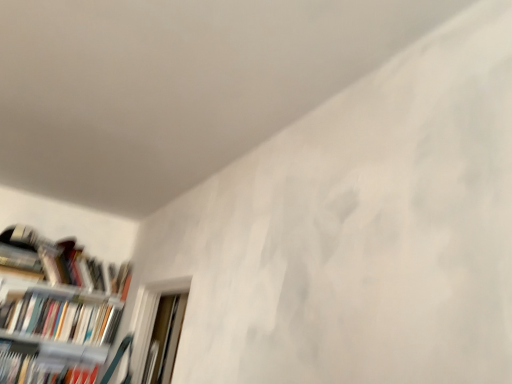
Question: Considering the relative positions of white plastic bookcase at lower left and hardcover book at left, marked as the first book in a top-to-bottom arrangement, in the image provided, is white plastic bookcase at lower left to the left of hardcover book at left, marked as the first book in a top-to-bottom arrangement, from the viewer's perspective?

Choices:
 (A) no
 (B) yes

Answer: (B)

Question: Does white plastic bookcase at lower left have a greater height compared to hardcover book at left, the third book from the bottom?

Choices:
 (A) no
 (B) yes

Answer: (B)

Question: From the image's perspective, is white plastic bookcase at lower left located beneath hardcover book at left, marked as the first book in a top-to-bottom arrangement?

Choices:
 (A) no
 (B) yes

Answer: (B)

Question: From a real-world perspective, does white plastic bookcase at lower left stand above hardcover book at left, the third book from the bottom?

Choices:
 (A) yes
 (B) no

Answer: (B)

Question: Is the depth of white plastic bookcase at lower left less than that of hardcover book at left, the third book from the bottom?

Choices:
 (A) no
 (B) yes

Answer: (B)

Question: Is white plastic bookcase at lower left next to hardcover book at left, marked as the first book in a top-to-bottom arrangement?

Choices:
 (A) no
 (B) yes

Answer: (A)

Question: Considering the relative positions of white plastic bookcase at lower left and hardcover book at lower left, positioned as the third book in top-to-bottom order, in the image provided, is white plastic bookcase at lower left to the right of hardcover book at lower left, positioned as the third book in top-to-bottom order, from the viewer's perspective?

Choices:
 (A) yes
 (B) no

Answer: (A)

Question: Is white plastic bookcase at lower left looking in the opposite direction of hardcover book at lower left, positioned as the third book in top-to-bottom order?

Choices:
 (A) no
 (B) yes

Answer: (B)

Question: From the image's perspective, would you say white plastic bookcase at lower left is shown under hardcover book at lower left, the 1th book from the bottom?

Choices:
 (A) no
 (B) yes

Answer: (A)

Question: Does white plastic bookcase at lower left have a greater height compared to hardcover book at lower left, positioned as the third book in top-to-bottom order?

Choices:
 (A) no
 (B) yes

Answer: (B)

Question: From the image's perspective, does white plastic bookcase at lower left appear higher than hardcover book at lower left, positioned as the third book in top-to-bottom order?

Choices:
 (A) no
 (B) yes

Answer: (B)

Question: Does white plastic bookcase at lower left have a greater width compared to hardcover book at lower left, the 1th book from the bottom?

Choices:
 (A) yes
 (B) no

Answer: (A)

Question: From the image's perspective, is white plastic bookcase at lower left located above white glossy bookshelf at left, acting as the 2th book starting from the top?

Choices:
 (A) no
 (B) yes

Answer: (A)